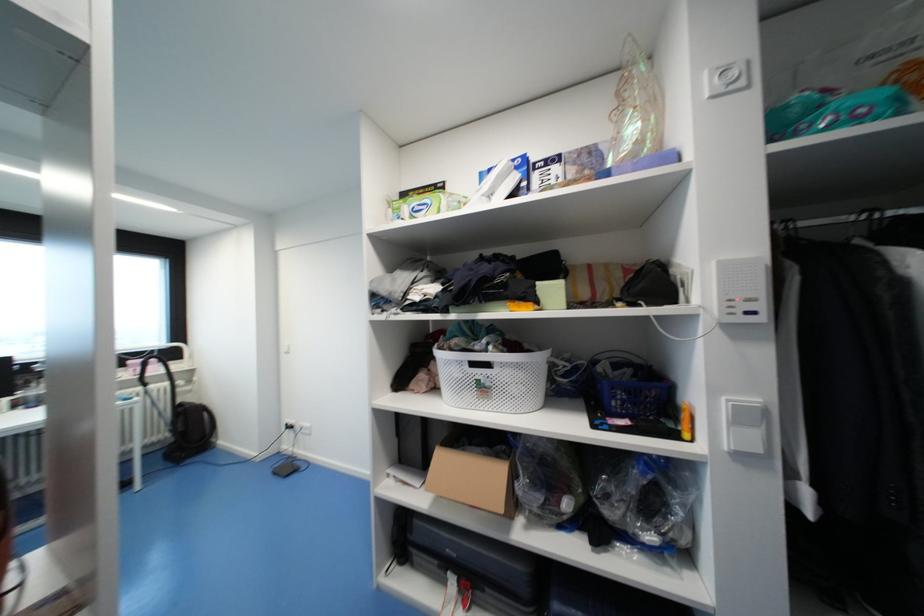
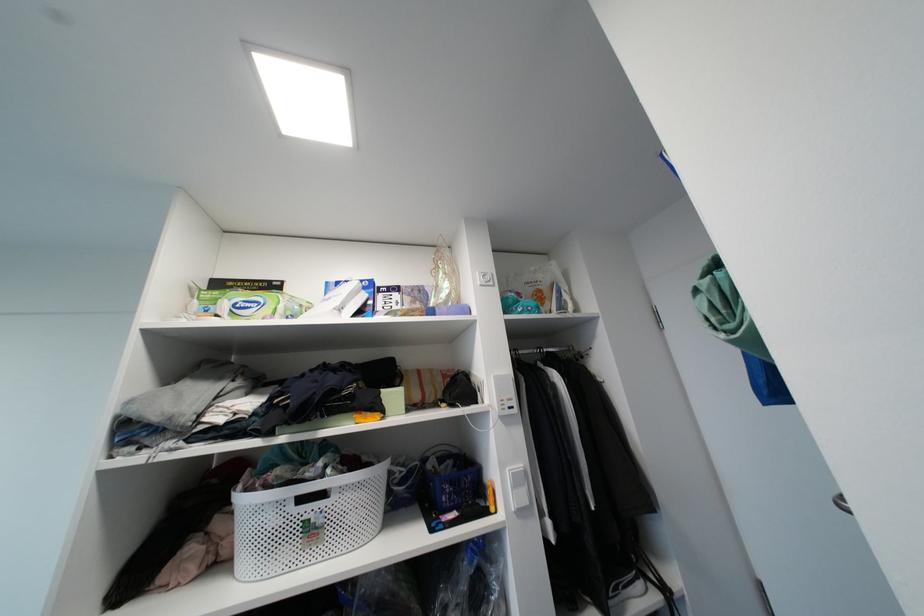
The first image is from the beginning of the video and the second image is from the end. How did the camera likely rotate when shooting the video?

The camera's rotation is toward right-up.